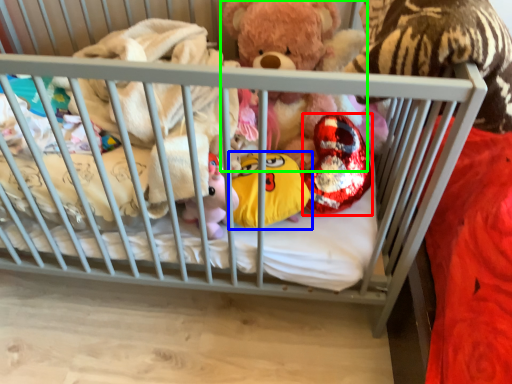
Question: Considering the real-world distances, which object is farthest from toy (highlighted by a red box)? toy (highlighted by a blue box) or teddy bear (highlighted by a green box)?

Choices:
 (A) toy
 (B) teddy bear

Answer: (B)